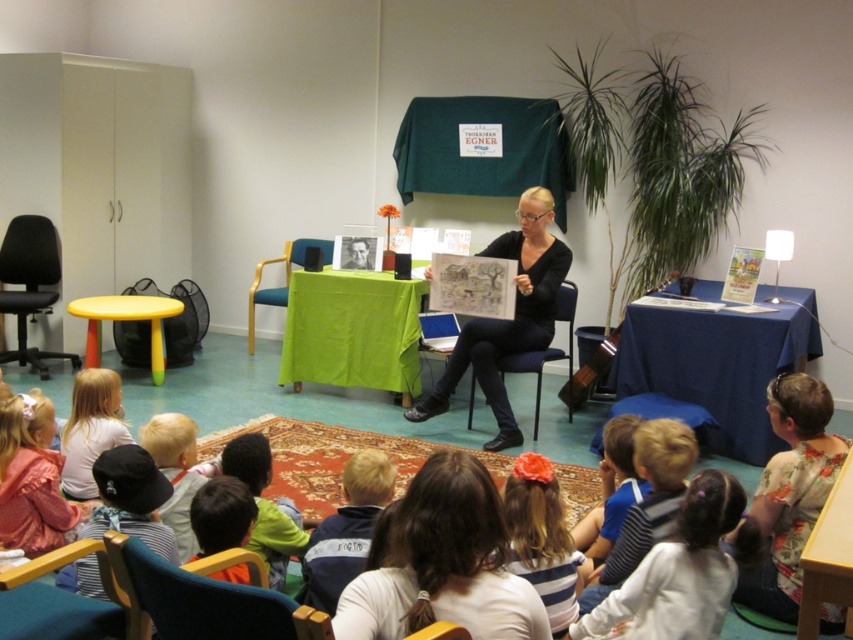
Question: Which of the following is the farthest from the observer?

Choices:
 (A) black fabric chair at center
 (B) blue fabric chair at lower left
 (C) floral fabric dress at lower right

Answer: (A)

Question: Which point is farther to the camera?

Choices:
 (A) black matte/black texturedobject at center
 (B) blue fabric chair at lower left
 (C) black fabric chair at center

Answer: (C)

Question: Among these points, which one is farthest from the camera?

Choices:
 (A) (4, 278)
 (B) (384, 576)

Answer: (A)

Question: Can you confirm if black matte/black texturedobject at center is thinner than black fabric chair at left?

Choices:
 (A) yes
 (B) no

Answer: (B)

Question: Where is striped fabric hairband at center located in relation to black fabric chair at center in the image?

Choices:
 (A) below
 (B) above

Answer: (A)

Question: Is smooth brown hair at center to the right of white fabric hairband at lower right from the viewer's perspective?

Choices:
 (A) no
 (B) yes

Answer: (A)